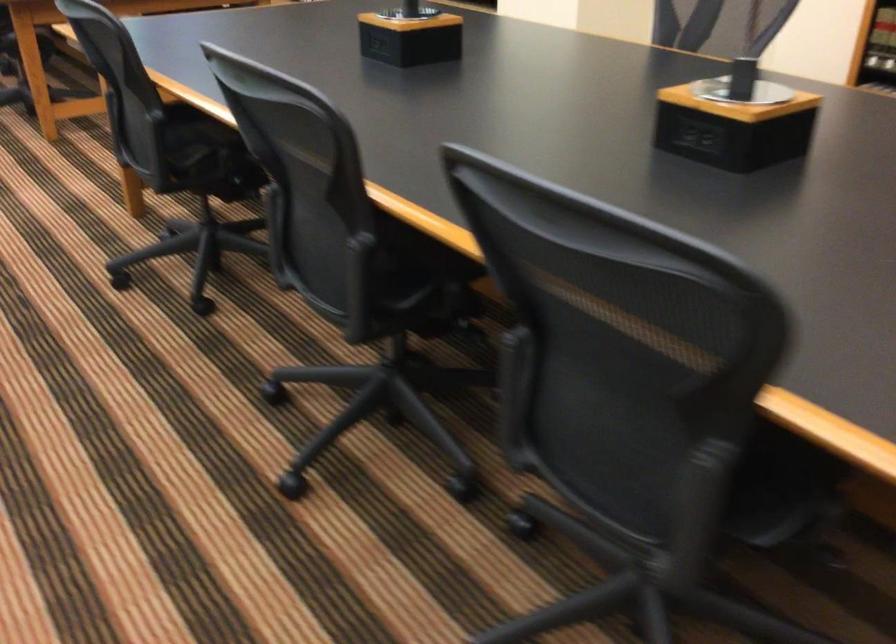
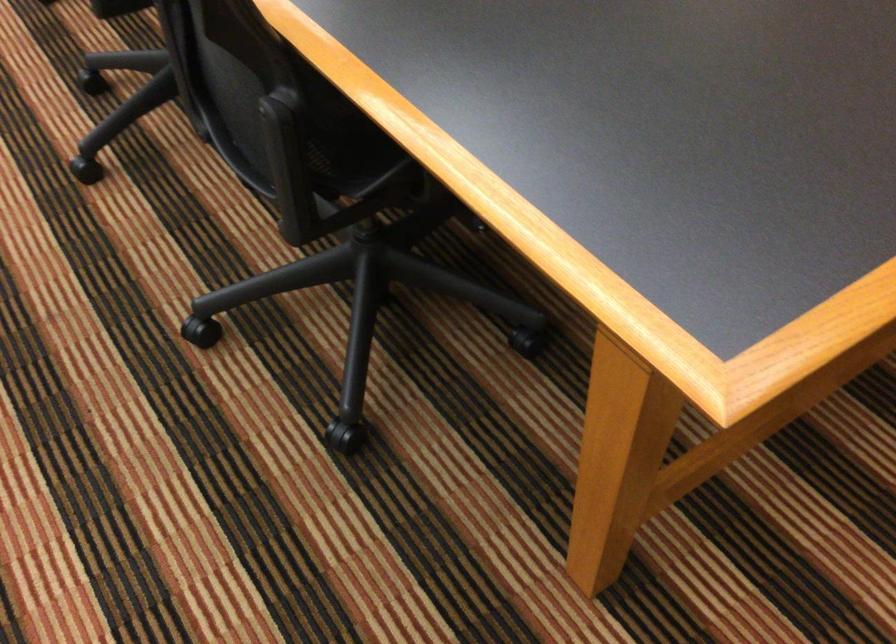
Where in the second image is the point corresponding to the point at 298,489 from the first image?

(85, 169)